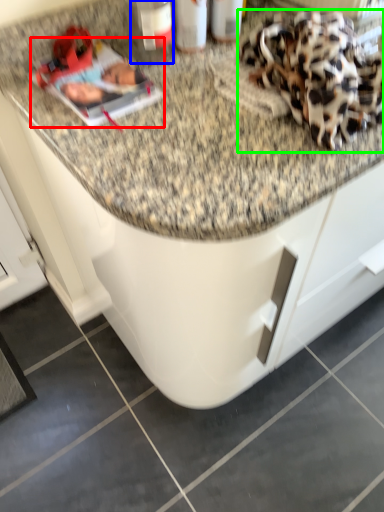
Question: Which object is positioned farthest from magazine (highlighted by a red box)? Select from bottle (highlighted by a blue box) and stuff (highlighted by a green box).

Choices:
 (A) bottle
 (B) stuff

Answer: (B)